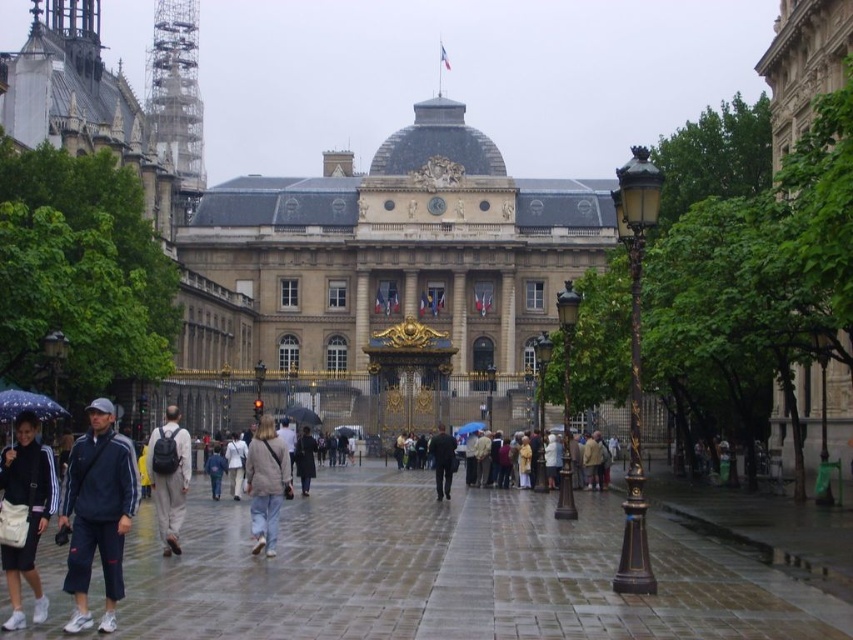
You are standing at the point closest to the historic building. Which of the two points, point (309, 460) or point (213, 499), is farther away from you?

Point (309, 460) is behind point (213, 499), so it is farther away from you.

You are standing at the camera position in the scene. There is a denim jacket at center. Can you reach the denim jacket without moving from your current position?

The denim jacket at center and camera are 94.35 meters apart, so you cannot reach the denim jacket without moving from your current position.

You are standing in front of the grand historic building with a dome and flags. You want to take a photo of a specific point located at coordinates point [311,464]. If your camera has a maximum focus range of 300 feet, will you be able to capture that point clearly?

The distance of point [311,464] from the camera is 329.41 feet, which exceeds the camera maximum focus range of 300 feet. Therefore, you won not be able to capture that point clearly.